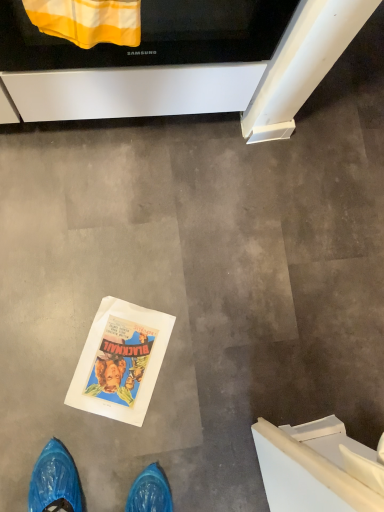
Question: Does black glossy oven at upper center have a smaller size compared to yellow striped fabric at upper center?

Choices:
 (A) no
 (B) yes

Answer: (A)

Question: Is the position of black glossy oven at upper center less distant than that of yellow striped fabric at upper center?

Choices:
 (A) yes
 (B) no

Answer: (B)

Question: Can you confirm if black glossy oven at upper center is positioned to the right of yellow striped fabric at upper center?

Choices:
 (A) no
 (B) yes

Answer: (B)

Question: Does black glossy oven at upper center have a lesser width compared to yellow striped fabric at upper center?

Choices:
 (A) yes
 (B) no

Answer: (B)

Question: Considering the relative sizes of black glossy oven at upper center and yellow striped fabric at upper center in the image provided, is black glossy oven at upper center bigger than yellow striped fabric at upper center?

Choices:
 (A) yes
 (B) no

Answer: (A)

Question: Is black glossy oven at upper center beside yellow striped fabric at upper center?

Choices:
 (A) no
 (B) yes

Answer: (A)

Question: Considering the relative positions of yellow striped fabric at upper center and black glossy oven at upper center in the image provided, is yellow striped fabric at upper center to the right of black glossy oven at upper center from the viewer's perspective?

Choices:
 (A) no
 (B) yes

Answer: (A)

Question: Is there a large distance between yellow striped fabric at upper center and black glossy oven at upper center?

Choices:
 (A) yes
 (B) no

Answer: (B)

Question: Considering the relative sizes of yellow striped fabric at upper center and black glossy oven at upper center in the image provided, is yellow striped fabric at upper center wider than black glossy oven at upper center?

Choices:
 (A) yes
 (B) no

Answer: (B)

Question: Is yellow striped fabric at upper center positioned in front of black glossy oven at upper center?

Choices:
 (A) yes
 (B) no

Answer: (A)

Question: Can you confirm if yellow striped fabric at upper center is smaller than black glossy oven at upper center?

Choices:
 (A) no
 (B) yes

Answer: (B)

Question: From the image's perspective, does yellow striped fabric at upper center appear higher than black glossy oven at upper center?

Choices:
 (A) no
 (B) yes

Answer: (A)

Question: From the image's perspective, is yellow striped fabric at upper center above or below black glossy oven at upper center?

Choices:
 (A) below
 (B) above

Answer: (A)